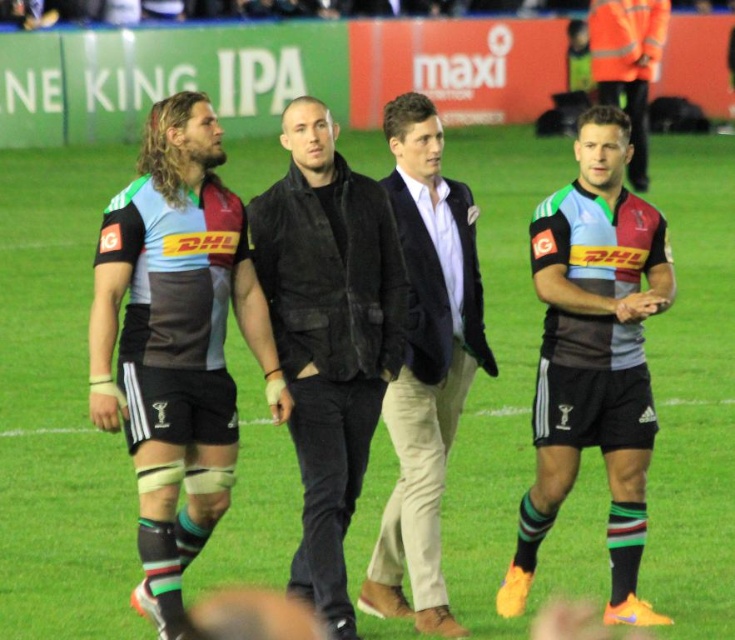
You are a photographer at the rugby field and want to take a photo of the striped jersey at center. Where should you position your camera to capture it best?

The striped jersey at center is located at coordinates 0.558 on the x axis and 0.808 on the y axis, so position the camera at that point for optimal capture.

You are a photographer standing at the back of the rugby field. You want to take a photo that includes both the striped jersey at center and the light brown leather jacket at center. Given that your camera has a maximum focus range of 25 inches, will you be able to capture both subjects clearly in the same frame?

The distance between the striped jersey at center and the light brown leather jacket at center is 26.93 inches, which exceeds the camera maximum focus range of 25 inches. Therefore, you cannot capture both subjects clearly in the same frame.

You are a photographer trying to capture a closeup of both the matte jersey at left and the matte black shorts at right during the ceremony. Since you want both items to appear equally sized in your photo, which one should you move closer to the camera?

The matte jersey at left is smaller than the matte black shorts at right, so you should move closer to the matte jersey at left to make it appear larger in the photo and balance their sizes.